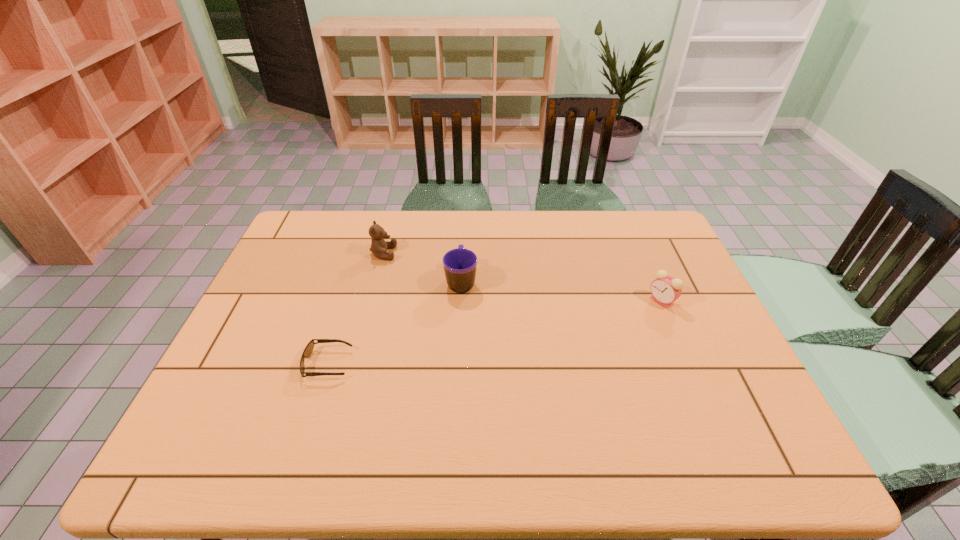
Where is `unoccupied area between the nearest object and the third object from left to right`? The width and height of the screenshot is (960, 540). unoccupied area between the nearest object and the third object from left to right is located at coordinates (395, 322).

The height and width of the screenshot is (540, 960). Find the location of `vacant space that is in between the rightmost object and the third object from left to right`. vacant space that is in between the rightmost object and the third object from left to right is located at coordinates (562, 291).

The image size is (960, 540). Identify the location of free space that is in between the mug and the farthest object. (422, 267).

Locate an element on the screen. Image resolution: width=960 pixels, height=540 pixels. free space between the teddy bear and the nearest object is located at coordinates (356, 308).

At what (x,y) coordinates should I click in order to perform the action: click on vacant area that lies between the teddy bear and the nearest object. Please return your answer as a coordinate pair (x, y). Looking at the image, I should click on (356, 308).

Find the location of a particular element. The width and height of the screenshot is (960, 540). free space between the teddy bear and the mug is located at coordinates (422, 267).

Image resolution: width=960 pixels, height=540 pixels. In order to click on free space between the second object from right to left and the alarm clock in this screenshot , I will do `click(562, 291)`.

At what (x,y) coordinates should I click in order to perform the action: click on vacant area that lies between the nearest object and the mug. Please return your answer as a coordinate pair (x, y). The width and height of the screenshot is (960, 540). Looking at the image, I should click on (395, 322).

This screenshot has height=540, width=960. Identify the location of unoccupied area between the mug and the farthest object. (422, 267).

Image resolution: width=960 pixels, height=540 pixels. Find the location of `the second closest object to the nearest object`. the second closest object to the nearest object is located at coordinates (379, 246).